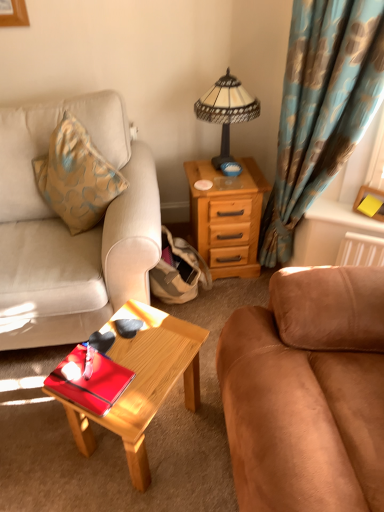
Question: Should I look upward or downward to see wooden drawer at right?

Choices:
 (A) up
 (B) down

Answer: (A)

Question: Is suede brown couch at right, the 1th studio couch when ordered from right to left, thinner than wooden drawer at right?

Choices:
 (A) no
 (B) yes

Answer: (A)

Question: Are suede brown couch at right, the 1th studio couch when ordered from right to left, and wooden drawer at right making contact?

Choices:
 (A) yes
 (B) no

Answer: (B)

Question: Is wooden drawer at right at the back of suede brown couch at right, which is the 2th studio couch from left to right?

Choices:
 (A) yes
 (B) no

Answer: (B)

Question: From a real-world perspective, is suede brown couch at right, the 1th studio couch when ordered from right to left, over wooden drawer at right?

Choices:
 (A) no
 (B) yes

Answer: (B)

Question: Can you confirm if suede brown couch at right, which is the 2th studio couch from left to right, is wider than wooden drawer at right?

Choices:
 (A) no
 (B) yes

Answer: (B)

Question: From the image's perspective, is suede brown couch at right, the 1th studio couch when ordered from right to left, beneath wooden drawer at right?

Choices:
 (A) yes
 (B) no

Answer: (A)

Question: From a real-world perspective, is suede brown couch at right, which is the 2th studio couch from left to right, physically below shiny wood coffee table at center?

Choices:
 (A) yes
 (B) no

Answer: (B)

Question: Is suede brown couch at right, which is the 2th studio couch from left to right, directly adjacent to shiny wood coffee table at center?

Choices:
 (A) yes
 (B) no

Answer: (B)

Question: From a real-world perspective, is suede brown couch at right, the 1th studio couch when ordered from right to left, on shiny wood coffee table at center?

Choices:
 (A) no
 (B) yes

Answer: (B)

Question: From the image's perspective, would you say suede brown couch at right, the 1th studio couch when ordered from right to left, is positioned over shiny wood coffee table at center?

Choices:
 (A) yes
 (B) no

Answer: (A)

Question: Is suede brown couch at right, which is the 2th studio couch from left to right, smaller than shiny wood coffee table at center?

Choices:
 (A) no
 (B) yes

Answer: (A)

Question: Is suede brown couch at right, which is the 2th studio couch from left to right, shorter than shiny wood coffee table at center?

Choices:
 (A) yes
 (B) no

Answer: (B)

Question: Is glossy red tray at center at the back of suede brown couch at right, which is the 2th studio couch from left to right?

Choices:
 (A) no
 (B) yes

Answer: (A)